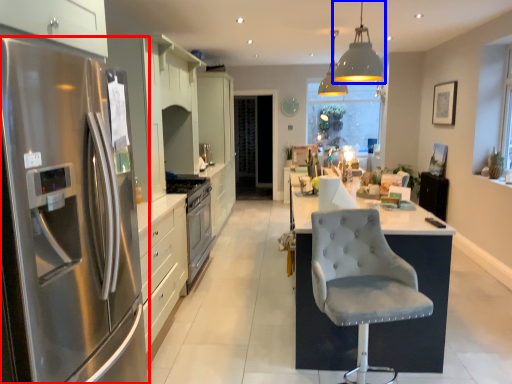
Question: Which of the following is the closest to the observer, refrigerator (highlighted by a red box) or light fixture (highlighted by a blue box)?

Choices:
 (A) refrigerator
 (B) light fixture

Answer: (A)